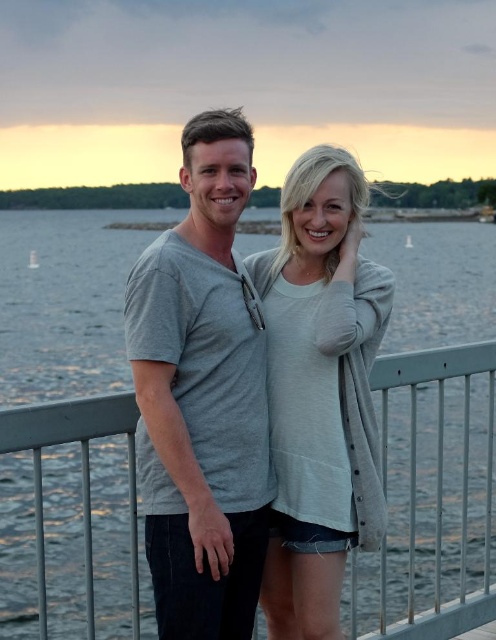
Is gray matte t-shirt at center positioned before gray soft sweater at center?

Yes, it is in front of gray soft sweater at center.

Is gray matte t-shirt at center bigger than gray soft sweater at center?

No.

Is point (182, 440) closer to camera compared to point (277, 566)?

Yes, point (182, 440) is in front of point (277, 566).

You are a GUI agent. You are given a task and a screenshot of the screen. Output one action in this format:
    pyautogui.click(x=<x>, y=<y>)
    Task: Click on the gray matte t-shirt at center
    The height and width of the screenshot is (640, 496).
    Given the screenshot: What is the action you would take?
    pyautogui.click(x=201, y=396)

Between gray soft sweater at center and gray metallic rail at center, which one is positioned higher?

gray soft sweater at center

Is gray soft sweater at center below gray metallic rail at center?

Incorrect, gray soft sweater at center is not positioned below gray metallic rail at center.

What do you see at coordinates (319, 392) in the screenshot?
I see `gray soft sweater at center` at bounding box center [319, 392].

Find the location of a particular element. gray soft sweater at center is located at coordinates (319, 392).

Is gray matte t-shirt at center bigger than gray metallic rail at center?

No.

Between gray matte t-shirt at center and gray metallic rail at center, which one appears on the left side from the viewer's perspective?

gray metallic rail at center is more to the left.

Does point (251, 508) come closer to viewer compared to point (422, 400)?

Yes.

The height and width of the screenshot is (640, 496). In order to click on gray matte t-shirt at center in this screenshot , I will do `click(201, 396)`.